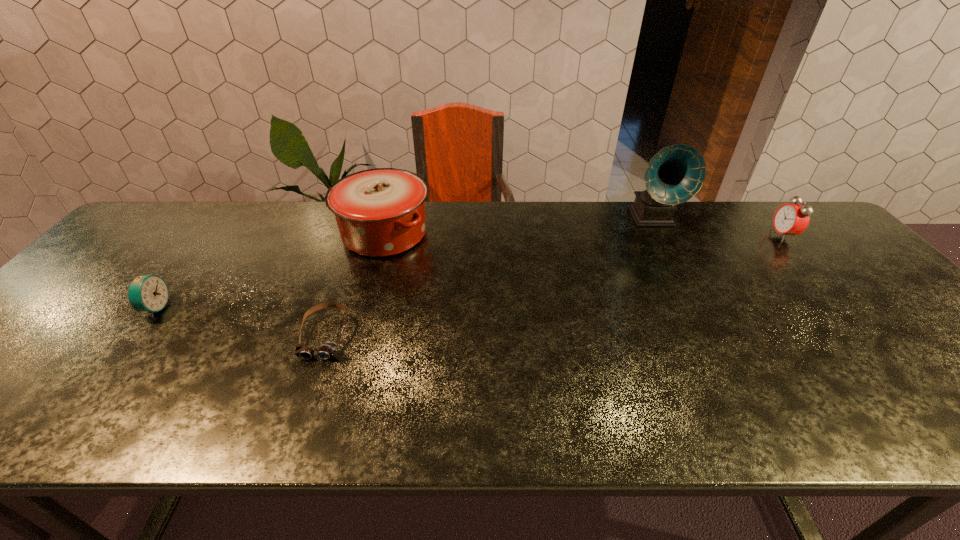
Locate an element on the screen. The image size is (960, 540). free space between the phonograph_record and the rightmost object is located at coordinates (717, 227).

Locate an element on the screen. This screenshot has height=540, width=960. vacant space in between the taller alarm clock and the second shortest object is located at coordinates (469, 272).

Locate an element on the screen. vacant area that lies between the rightmost object and the nearer alarm clock is located at coordinates (469, 272).

Locate an element on the screen. The width and height of the screenshot is (960, 540). free spot between the fourth tallest object and the shortest object is located at coordinates (240, 321).

This screenshot has height=540, width=960. Identify the location of free space between the phonograph_record and the leftmost object. (403, 263).

This screenshot has width=960, height=540. Find the location of `free space between the leftmost object and the phonograph_record`. free space between the leftmost object and the phonograph_record is located at coordinates click(x=403, y=263).

The height and width of the screenshot is (540, 960). I want to click on object that is the second closest one to the third shortest object, so click(x=380, y=212).

Image resolution: width=960 pixels, height=540 pixels. Identify the location of the closest object to the fourth shortest object. (327, 350).

The width and height of the screenshot is (960, 540). Identify the location of vacant space that satisfies the following two spatial constraints: 1. on the front-facing side of the right alarm clock; 2. on the front-facing side of the shortest object. (870, 335).

At what (x,y) coordinates should I click in order to perform the action: click on free space that satisfies the following two spatial constraints: 1. from the horn of the phonograph_record; 2. on the front-facing side of the nearer alarm clock. Please return your answer as a coordinate pair (x, y). The height and width of the screenshot is (540, 960). Looking at the image, I should click on (699, 308).